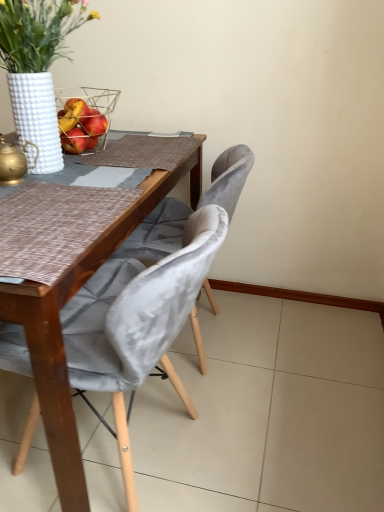
This screenshot has height=512, width=384. I want to click on vacant space in front of metallic wire picnic basket at upper left, so click(x=86, y=167).